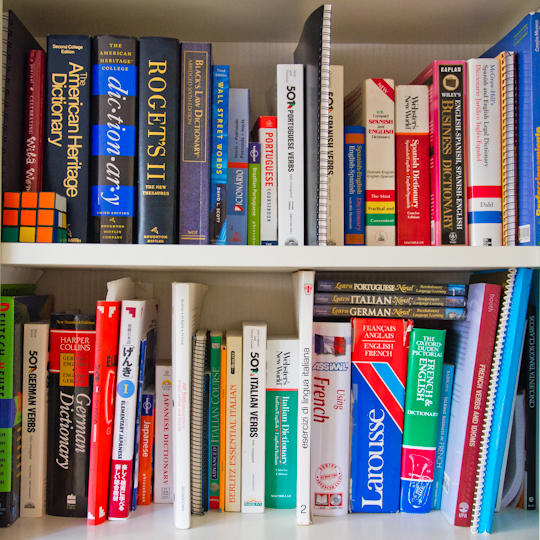
At what (x,y) coordinates should I click in order to perform the action: click on red books. Please return your answer as a coordinate pair (x, y). Image resolution: width=540 pixels, height=540 pixels. Looking at the image, I should click on (103, 369), (487, 342), (418, 182), (29, 131).